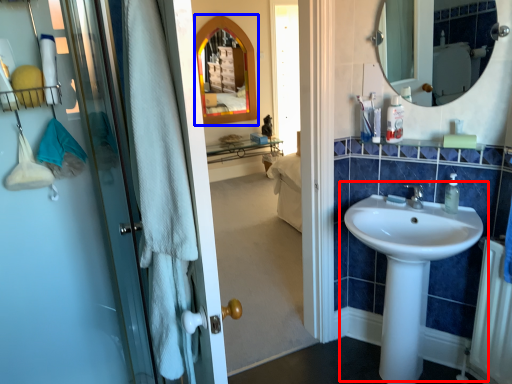
Question: Which object is further to the camera taking this photo, sink (highlighted by a red box) or medicine cabinet (highlighted by a blue box)?

Choices:
 (A) sink
 (B) medicine cabinet

Answer: (B)